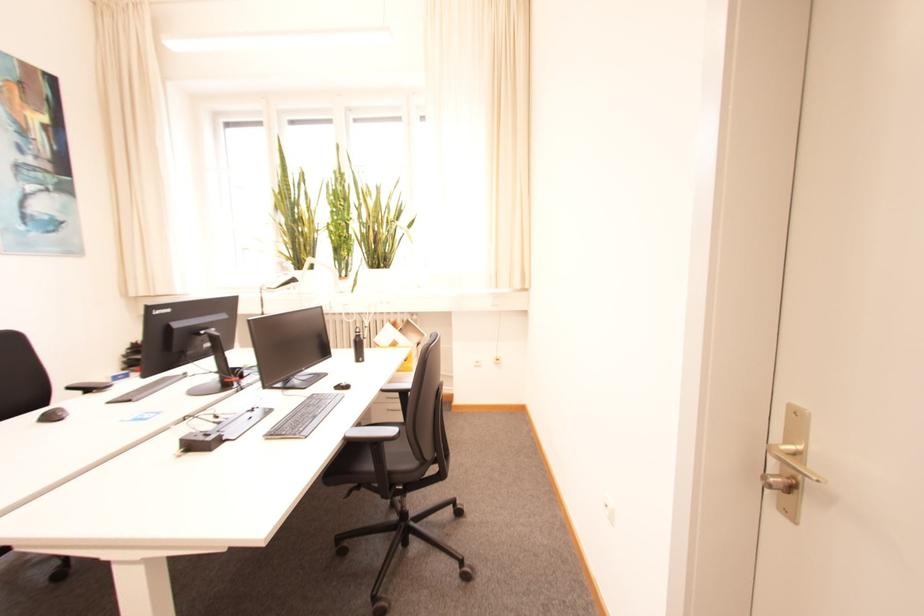
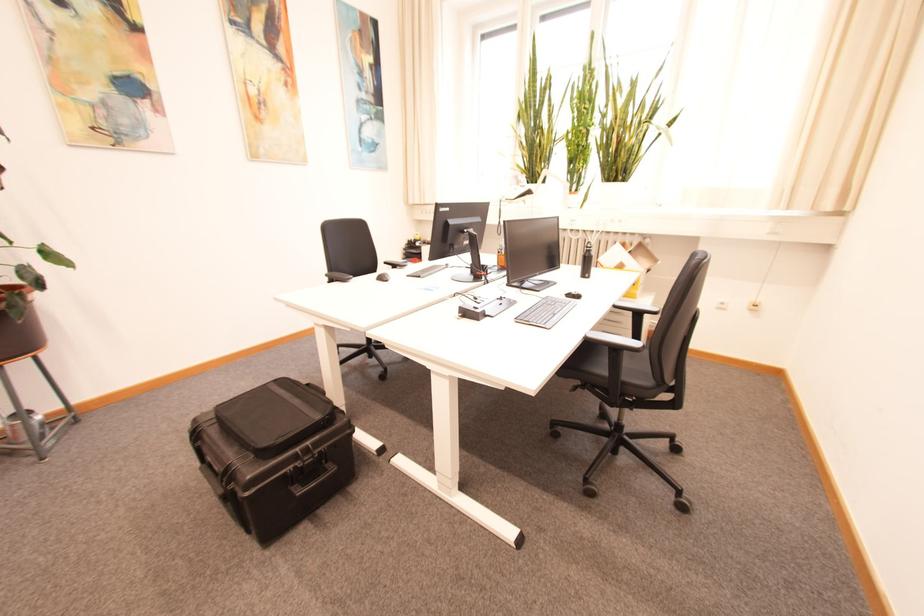
The point at (x=388, y=391) is marked in the first image. Where is the corresponding point in the second image?

(622, 308)